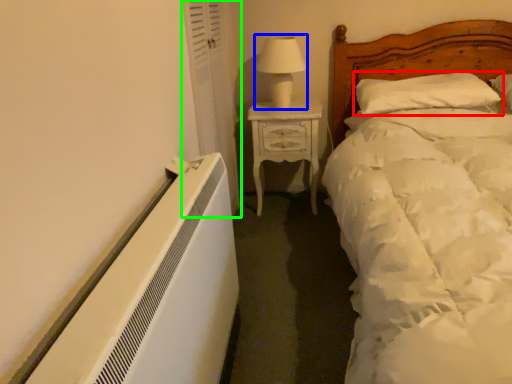
Question: Which is farther away from pillow (highlighted by a red box)? table lamp (highlighted by a blue box) or curtain (highlighted by a green box)?

Choices:
 (A) table lamp
 (B) curtain

Answer: (B)